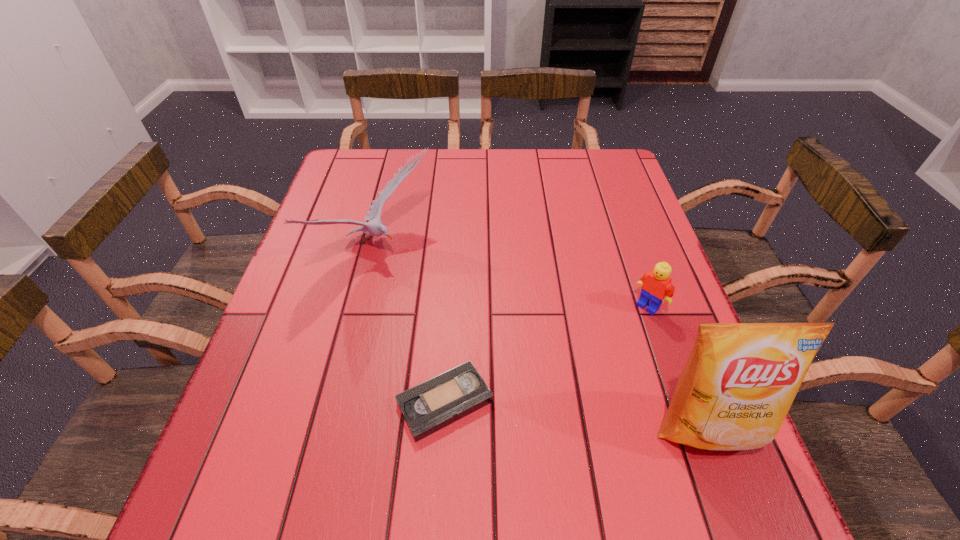
Locate an element on the screen. This screenshot has width=960, height=540. free spot between the videotape and the farthest object is located at coordinates (411, 326).

Image resolution: width=960 pixels, height=540 pixels. What are the coordinates of `vacant area that lies between the crisp (potato chip) and the farthest object` in the screenshot? It's located at (541, 339).

At what (x,y) coordinates should I click in order to perform the action: click on vacant point located between the gull and the videotape. Please return your answer as a coordinate pair (x, y). This screenshot has width=960, height=540. Looking at the image, I should click on (411, 326).

Find the location of `vacant space in between the videotape and the crisp (potato chip)`. vacant space in between the videotape and the crisp (potato chip) is located at coordinates (576, 415).

Find the location of a particular element. The image size is (960, 540). empty space between the crisp (potato chip) and the gull is located at coordinates (541, 339).

Locate which object is the second closest to the second shortest object. Please provide its 2D coordinates. Your answer should be formatted as a tuple, i.e. [(x, y)], where the tuple contains the x and y coordinates of a point satisfying the conditions above.

[(438, 402)]

Identify the location of the closest object relative to the tallest object. This screenshot has height=540, width=960. (655, 285).

This screenshot has height=540, width=960. What are the coordinates of `blank area in the image that satisfies the following two spatial constraints: 1. on the front side of the farthest object; 2. on the right side of the Lego` in the screenshot? It's located at (363, 306).

The width and height of the screenshot is (960, 540). I want to click on blank area in the image that satisfies the following two spatial constraints: 1. on the front side of the gull; 2. on the right side of the videotape, so click(339, 402).